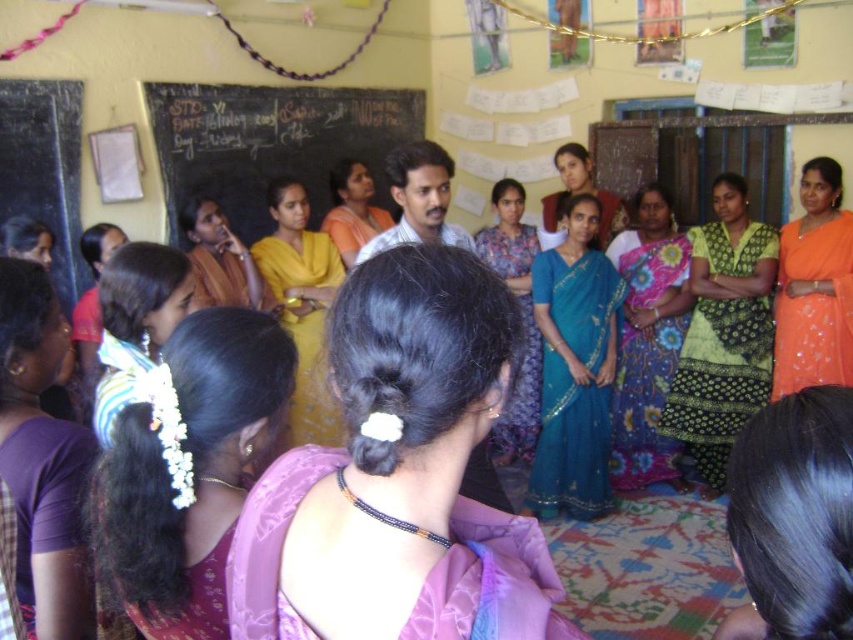
Question: Among these objects, which one is nearest to the camera?

Choices:
 (A) floral silk saree at center
 (B) orange satin saree at upper right
 (C) matte orange saree at center
 (D) blue silk saree at center

Answer: (B)

Question: Which of the following is the farthest from the observer?

Choices:
 (A) (268, 118)
 (B) (236, 376)
 (C) (602, 481)

Answer: (A)

Question: Which of the following is the farthest from the observer?

Choices:
 (A) (556, 164)
 (B) (229, 125)
 (C) (552, 314)
 (D) (173, 448)

Answer: (A)

Question: Does white floral hairpin at left have a smaller size compared to orange satin saree at upper right?

Choices:
 (A) no
 (B) yes

Answer: (B)

Question: Can you confirm if green printed saree at center is positioned to the right of white floral garland at left?

Choices:
 (A) no
 (B) yes

Answer: (B)

Question: Can you confirm if white floral hairpin at left is bigger than matte yellow saree at center?

Choices:
 (A) yes
 (B) no

Answer: (B)